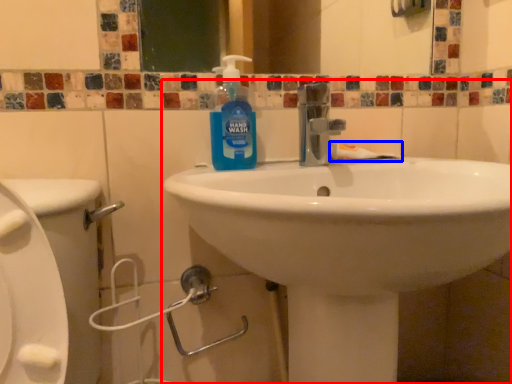
Question: Among these objects, which one is farthest to the camera, sink (highlighted by a red box) or toothpaste (highlighted by a blue box)?

Choices:
 (A) sink
 (B) toothpaste

Answer: (B)